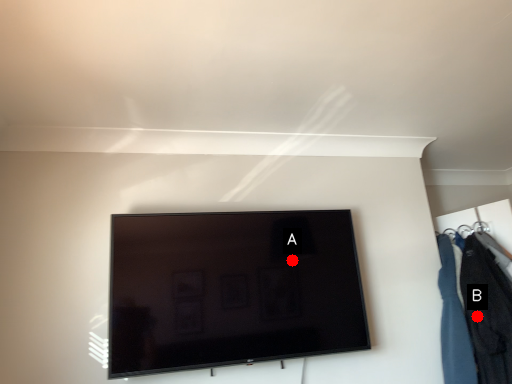
Question: Two points are circled on the image, labeled by A and B beside each circle. Which of the following is the farthest from the observer?

Choices:
 (A) A is further
 (B) B is further

Answer: (B)